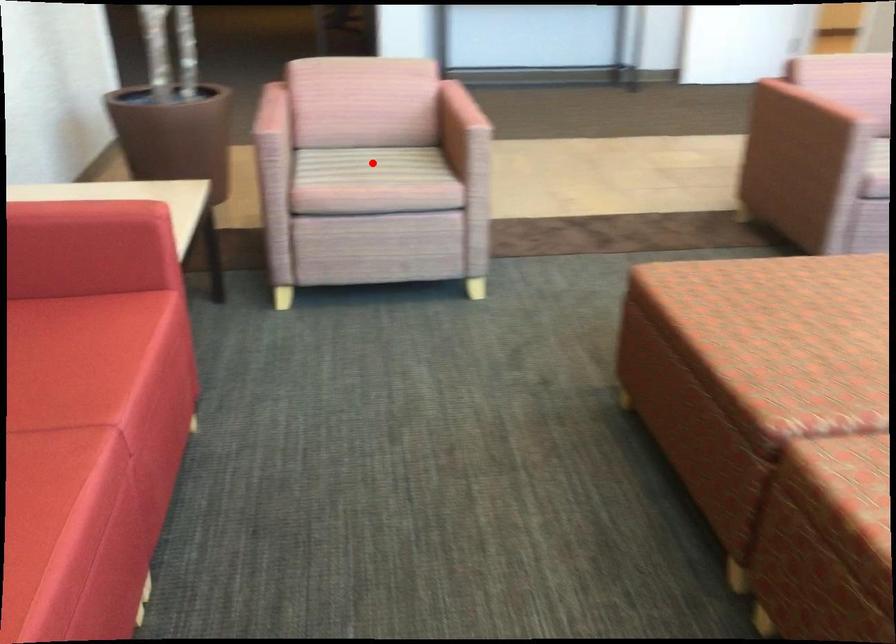
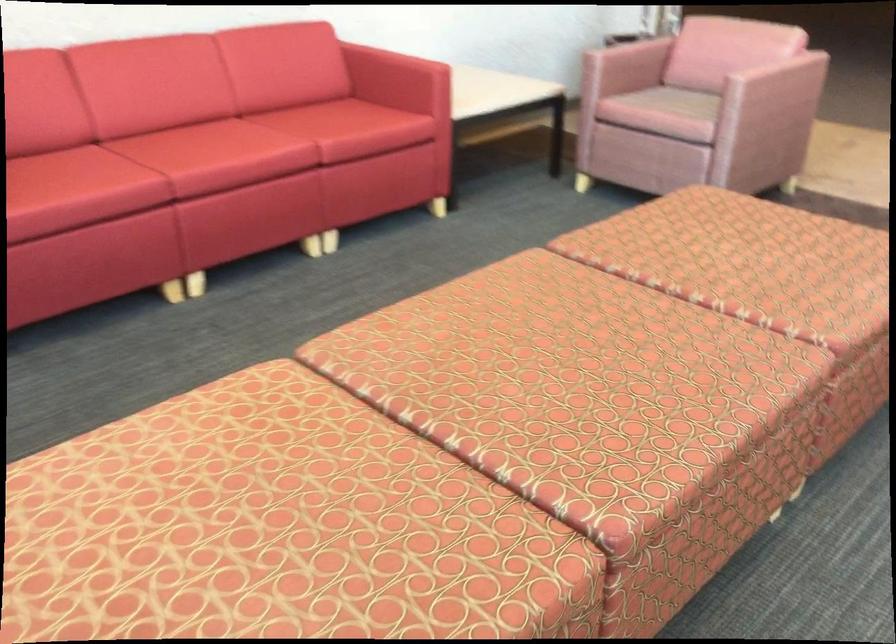
Question: I am providing you with two images of the same scene from different viewpoints. Image1 has a red point marked. In image2, the corresponding 3D location appears at what relative position? Reply with the corresponding letter.

Choices:
 (A) Closer
 (B) Farther

Answer: (B)